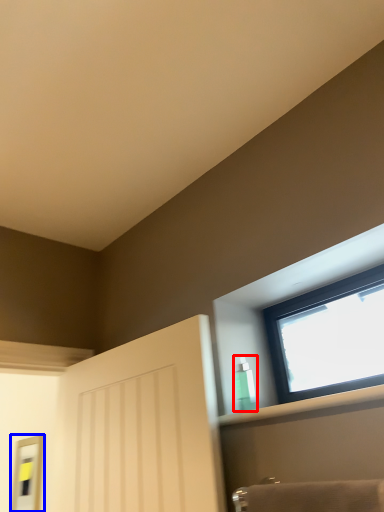
Question: Which object appears farthest to the camera in this image, toiletry (highlighted by a red box) or mirror (highlighted by a blue box)?

Choices:
 (A) toiletry
 (B) mirror

Answer: (B)